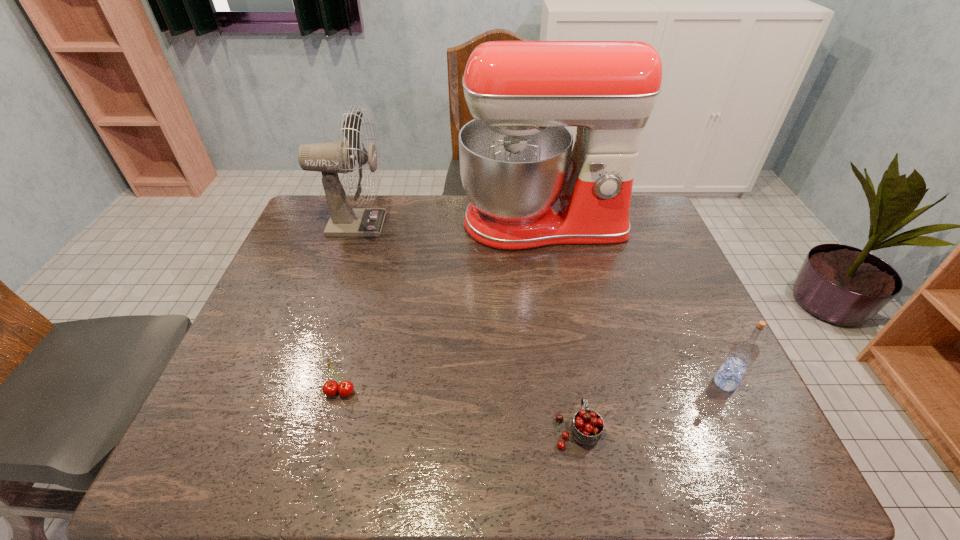
This screenshot has height=540, width=960. What are the coordinates of `vacant space that satisfies the following two spatial constraints: 1. on the handle side of the right cherry; 2. on the air flow direction of the fan` in the screenshot? It's located at (541, 224).

In order to click on vacant point that satisfies the following two spatial constraints: 1. on the back side of the vodka; 2. on the air flow direction of the fan in this screenshot , I will do `click(650, 224)`.

The image size is (960, 540). Find the location of `vacant position in the image that satisfies the following two spatial constraints: 1. on the handle side of the nearest object; 2. on the air flow direction of the fan`. vacant position in the image that satisfies the following two spatial constraints: 1. on the handle side of the nearest object; 2. on the air flow direction of the fan is located at coordinates (541, 224).

Image resolution: width=960 pixels, height=540 pixels. Find the location of `vacant space that satisfies the following two spatial constraints: 1. on the handle side of the third shortest object; 2. on the left side of the nearest object`. vacant space that satisfies the following two spatial constraints: 1. on the handle side of the third shortest object; 2. on the left side of the nearest object is located at coordinates (568, 383).

The image size is (960, 540). Find the location of `free space that satisfies the following two spatial constraints: 1. on the handle side of the rightmost object; 2. on the right side of the nearest object`. free space that satisfies the following two spatial constraints: 1. on the handle side of the rightmost object; 2. on the right side of the nearest object is located at coordinates (568, 383).